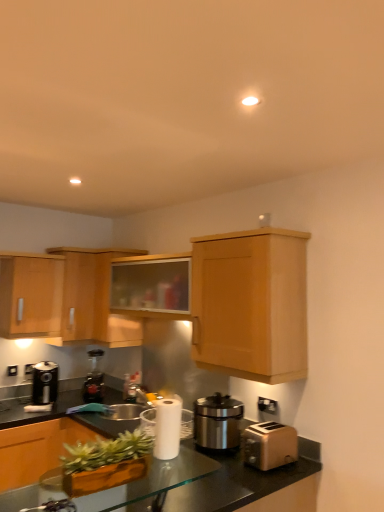
Question: From the image's perspective, is wooden cabinet at upper right, the 5th cabinetry viewed from the left, positioned above or below metallic black coffee machine at lower left, positioned as the 2th coffee machine in front-to-back order?

Choices:
 (A) above
 (B) below

Answer: (A)

Question: Is wooden cabinet at upper right, the 5th cabinetry viewed from the left, bigger or smaller than metallic black coffee machine at lower left, positioned as the 2th coffee machine in front-to-back order?

Choices:
 (A) small
 (B) big

Answer: (B)

Question: Which of these objects is positioned farthest from the green matte planter at lower left?

Choices:
 (A) translucent glass countertop at center
 (B) wooden cabinet at upper center, which ranks as the 4th cabinetry in left-to-right order
 (C) satin silver sink at center
 (D) transparent glass table at lower center
 (E) metallic black coffee machine at lower left, positioned as the 2th coffee machine in front-to-back order

Answer: (E)

Question: Which object is positioned closest to the brown matte toaster at lower right?

Choices:
 (A) satin silver appliance at center
 (B) satin silver sink at center
 (C) wooden cabinet at upper center, which ranks as the second cabinetry in right-to-left order
 (D) wooden cabinet at upper center, marked as the 3th cabinetry in a left-to-right arrangement
 (E) wooden cabinet at upper right, the first cabinetry positioned from the right

Answer: (A)